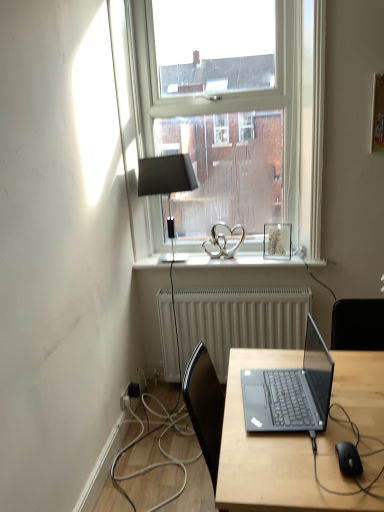
At what (x,y) coordinates should I click in order to perform the action: click on free spot in front of black matte computer mouse at lower right. Please return your answer as a coordinate pair (x, y). Image resolution: width=384 pixels, height=512 pixels. Looking at the image, I should click on (358, 490).